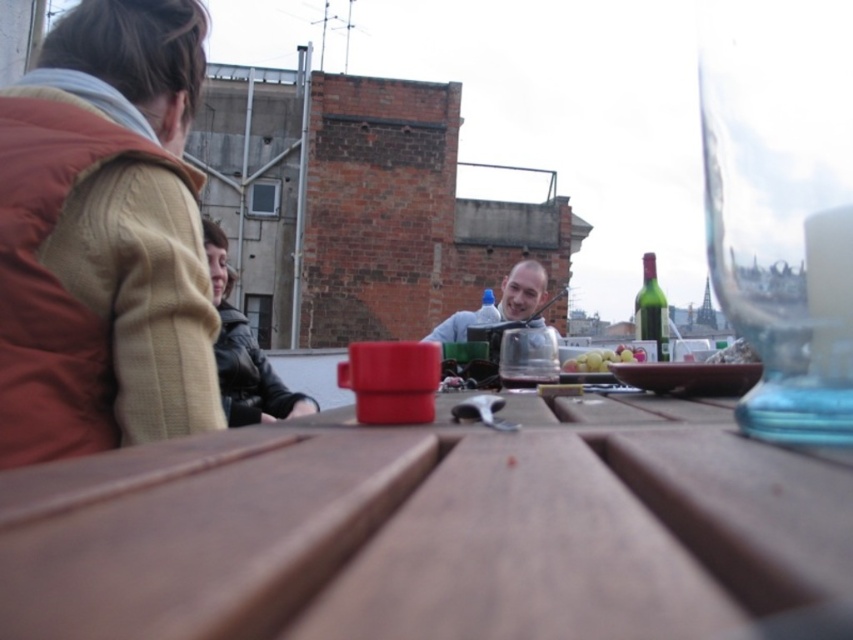
You are at a rooftop gathering and need to grab a drink quickly. You see the shiny silver flask at center and the translucent plastic bottle at center on the table. Which one is farther from your current position?

The shiny silver flask at center is 9.76 feet away from the translucent plastic bottle at center. Since you are at the same position, both are equally distant from you. However, if you are standing at the edge of the table, the one farther would depend on their placement. But based on the given information, the distance between them is 9.76 feet, so without knowing your exact position, we can only state their separation.

You are standing at the center of the table and want to place a new item at the location marked by point (651,308). What object is currently occupying that spot?

The point (651,308) indicates the location of the green glass bottle at upper right, so that spot is currently occupied by the green glass bottle at upper right.

You are standing at the edge of the rooftop and want to place a new item on the wooden picnic table at center. However, you notice the shiny silver flask at center is already there. Based on their positions, can you determine if the flask is on the table or underneath it?

The wooden picnic table at center is in front of the shiny silver flask at center, which means the flask is likely underneath the table since the table is blocking the view of the flask from above.